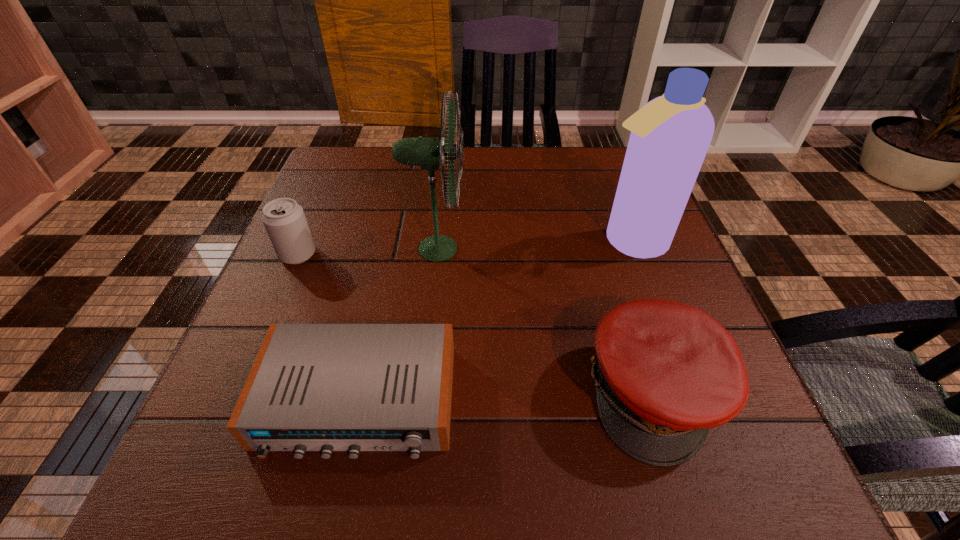
The width and height of the screenshot is (960, 540). I want to click on shampoo, so click(x=670, y=135).

This screenshot has width=960, height=540. What are the coordinates of `fan` in the screenshot? It's located at (428, 153).

The image size is (960, 540). In order to click on can in this screenshot , I will do `click(284, 220)`.

The width and height of the screenshot is (960, 540). In order to click on cap in this screenshot , I will do [x=666, y=372].

The image size is (960, 540). In order to click on radio receiver in this screenshot , I will do `click(313, 387)`.

The width and height of the screenshot is (960, 540). What are the coordinates of `vacant space located on the back of the shampoo` in the screenshot? It's located at (617, 208).

Identify the location of blank area located on the front-facing side of the fan. Image resolution: width=960 pixels, height=540 pixels. (606, 249).

Where is `vacant area located 0.130m on the front of the leftmost object`? The height and width of the screenshot is (540, 960). vacant area located 0.130m on the front of the leftmost object is located at coordinates (271, 316).

Where is `vacant region located 0.050m on the front of the cap with an emblem`? vacant region located 0.050m on the front of the cap with an emblem is located at coordinates (690, 505).

Image resolution: width=960 pixels, height=540 pixels. Find the location of `cap present at the near edge`. cap present at the near edge is located at coordinates (666, 372).